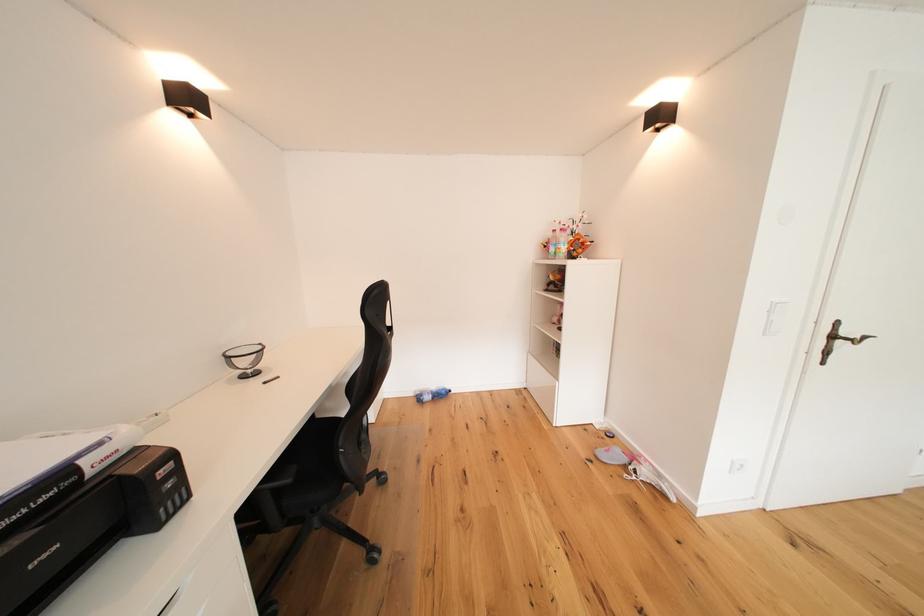
Where is `white light switch`? Image resolution: width=924 pixels, height=616 pixels. white light switch is located at coordinates (736, 464).